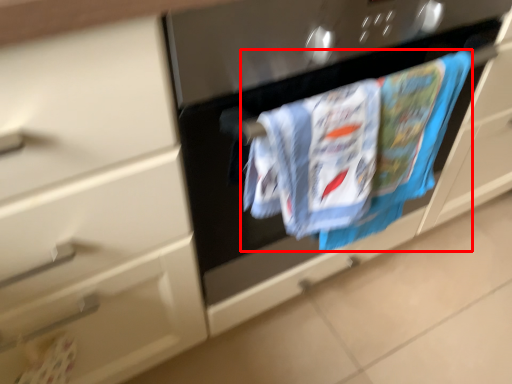
Question: From the image's perspective, what is the correct spatial relationship of laundry (annotated by the red box) in relation to door handle?

Choices:
 (A) below
 (B) above

Answer: (B)